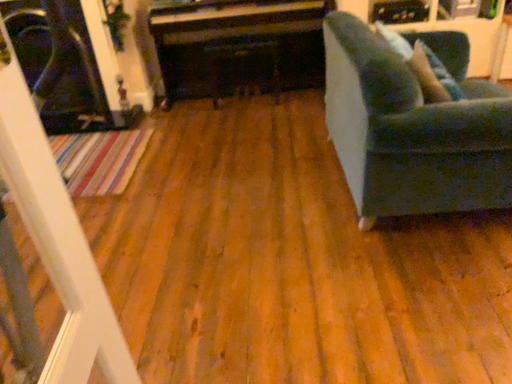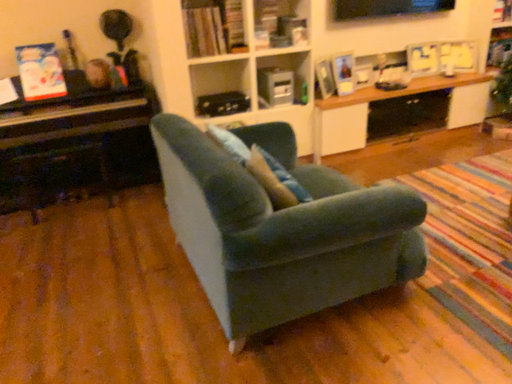
Question: How did the camera likely rotate when shooting the video?

Choices:
 (A) rotated right
 (B) rotated left

Answer: (A)